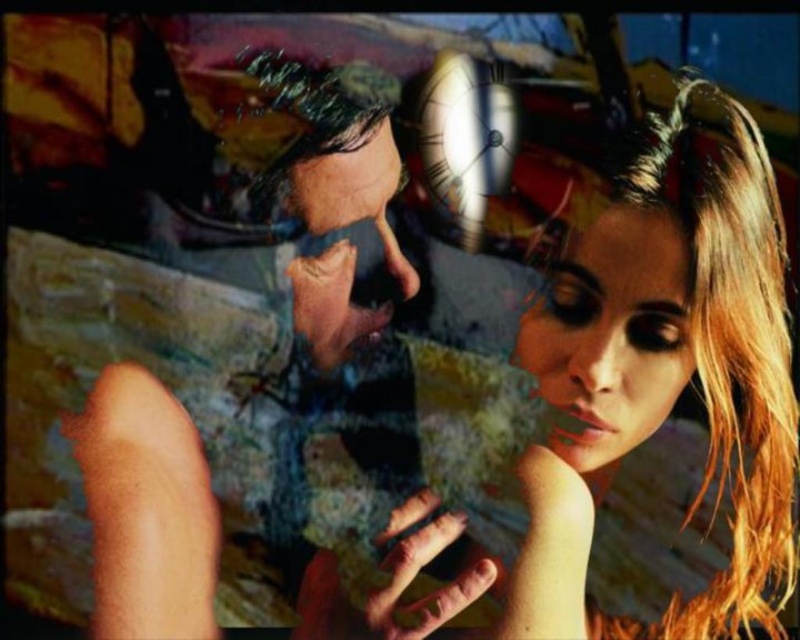
You are an art curator examining this digital artwork. You notice two faces labeled as smooth skin face at center and smooth skin face at upper center. Based on their sizes in the image, which face appears larger?

The smooth skin face at center appears larger because it has a greater height compared to the smooth skin face at upper center.

You are an artist analyzing this digital artwork. You notice two faces labeled as smooth skin face at center and smooth skin face at upper center. Which face do you think is bigger in the artwork?

The smooth skin face at center is larger in size than the smooth skin face at upper center.

You are a photographer trying to capture two faces in a photo. The smooth skin face at center and the smooth skin face at upper center are in your frame. Given that your camera has a focus range of 9 inches, can both faces be in focus at the same time?

→ The smooth skin face at center and smooth skin face at upper center are 10.03 inches apart. Since the distance between them exceeds the camera focus range of 9 inches, both faces cannot be in focus simultaneously.